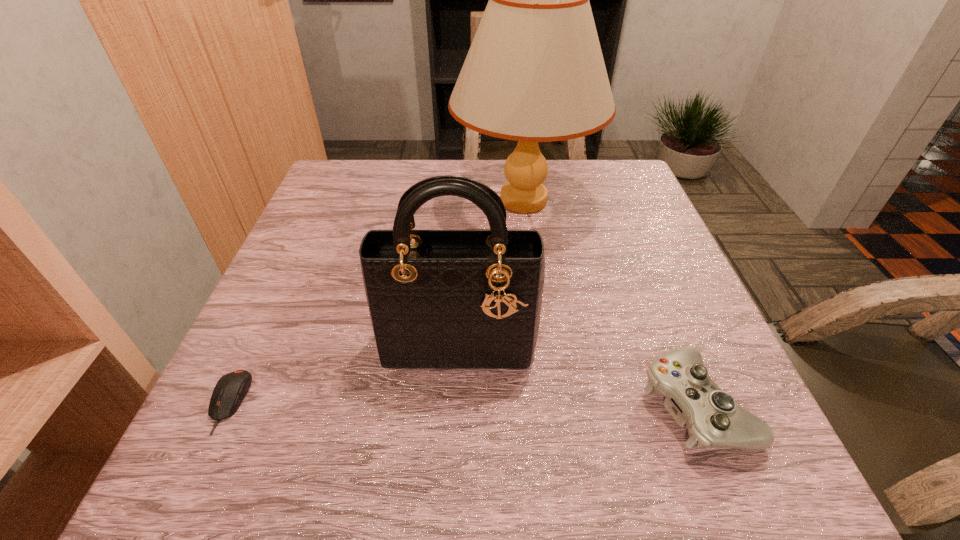
Locate an element on the screen. The image size is (960, 540). the tallest object is located at coordinates (535, 72).

Identify the location of lampshade. The image size is (960, 540). (535, 72).

Where is `handbag`? This screenshot has width=960, height=540. handbag is located at coordinates (453, 299).

You are a GUI agent. You are given a task and a screenshot of the screen. Output one action in this format:
    pyautogui.click(x=<x>, y=<y>)
    Task: Click on the second shortest object
    This screenshot has width=960, height=540.
    Given the screenshot: What is the action you would take?
    pyautogui.click(x=713, y=419)

Locate an element on the screen. computer mouse is located at coordinates (230, 390).

At what (x,y) coordinates should I click in order to perform the action: click on the shortest object. Please return your answer as a coordinate pair (x, y). The height and width of the screenshot is (540, 960). Looking at the image, I should click on (230, 390).

The width and height of the screenshot is (960, 540). Find the location of `vacant region located on the left of the farthest object`. vacant region located on the left of the farthest object is located at coordinates (366, 201).

Locate an element on the screen. Image resolution: width=960 pixels, height=540 pixels. vacant region located 0.150m at the front of the handbag with visible charms is located at coordinates 452,460.

At what (x,y) coordinates should I click in order to perform the action: click on vacant region located 0.050m on the back of the second shortest object. Please return your answer as a coordinate pair (x, y). This screenshot has width=960, height=540. Looking at the image, I should click on (668, 334).

Identify the location of free space located 0.090m on the front of the shortest object. (184, 499).